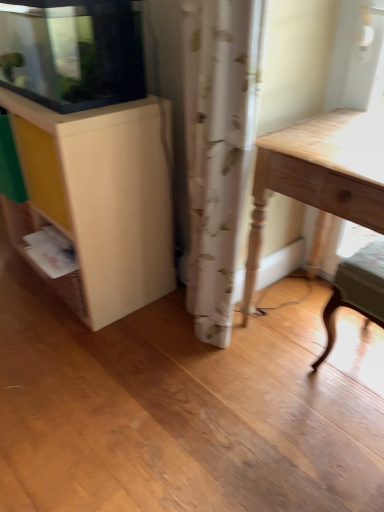
Question: In terms of width, does matte white cabinet at left, which ranks as the first cabinetry in bottom-to-top order, look wider or thinner when compared to light wood table at right?

Choices:
 (A) thin
 (B) wide

Answer: (A)

Question: From the image's perspective, is matte white cabinet at left, which ranks as the first cabinetry in bottom-to-top order, positioned above or below light wood table at right?

Choices:
 (A) below
 (B) above

Answer: (B)

Question: Based on their relative distances, which object is farther from the matte yellow drawer at left?

Choices:
 (A) matte white cabinet at upper left, which is the second cabinetry from bottom to top
 (B) light wood table at right
 (C) wooden chair at lower right
 (D) matte white cabinet at left, which ranks as the first cabinetry in bottom-to-top order

Answer: (C)

Question: Which object is the closest to the wooden chair at lower right?

Choices:
 (A) light wood table at right
 (B) matte white cabinet at upper left, placed as the 1th cabinetry when sorted from top to bottom
 (C) matte yellow drawer at left
 (D) matte white cabinet at left, which appears as the 2th cabinetry when viewed from the top

Answer: (A)